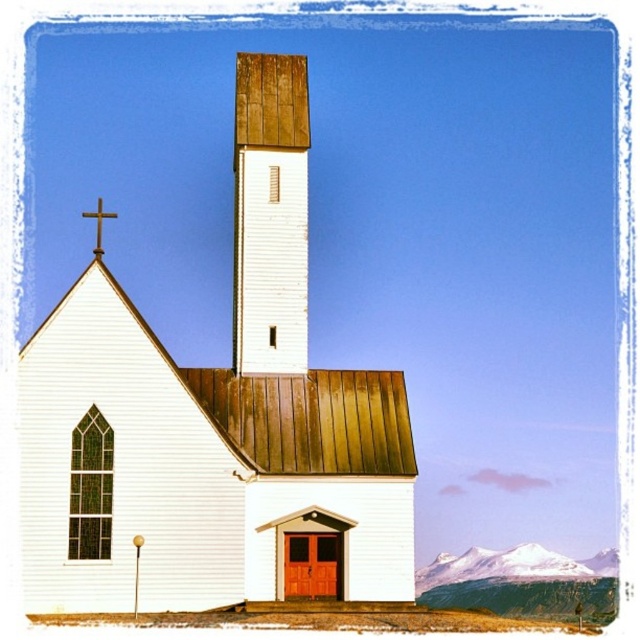
The image size is (640, 640). In order to click on wooden shingles at center in this screenshot , I will do `click(269, 214)`.

At what (x,y) coordinates should I click in order to perform the action: click on wooden shingles at center. Please return your answer as a coordinate pair (x, y). Looking at the image, I should click on (269, 214).

Does white wooden church at center have a lesser height compared to gold metallic cross at upper left?

In fact, white wooden church at center may be taller than gold metallic cross at upper left.

Is white wooden church at center smaller than gold metallic cross at upper left?

Actually, white wooden church at center might be larger than gold metallic cross at upper left.

Does point (237, 589) come behind point (97, 211)?

That is False.

Image resolution: width=640 pixels, height=640 pixels. In order to click on white wooden church at center in this screenshot , I will do `click(216, 422)`.

Does snowy white mountain at lower right have a lesser height compared to gold metallic cross at upper left?

Incorrect, snowy white mountain at lower right's height does not fall short of gold metallic cross at upper left's.

Is snowy white mountain at lower right thinner than gold metallic cross at upper left?

Incorrect, snowy white mountain at lower right's width is not less than gold metallic cross at upper left's.

Find the location of a particular element. The height and width of the screenshot is (640, 640). snowy white mountain at lower right is located at coordinates (513, 566).